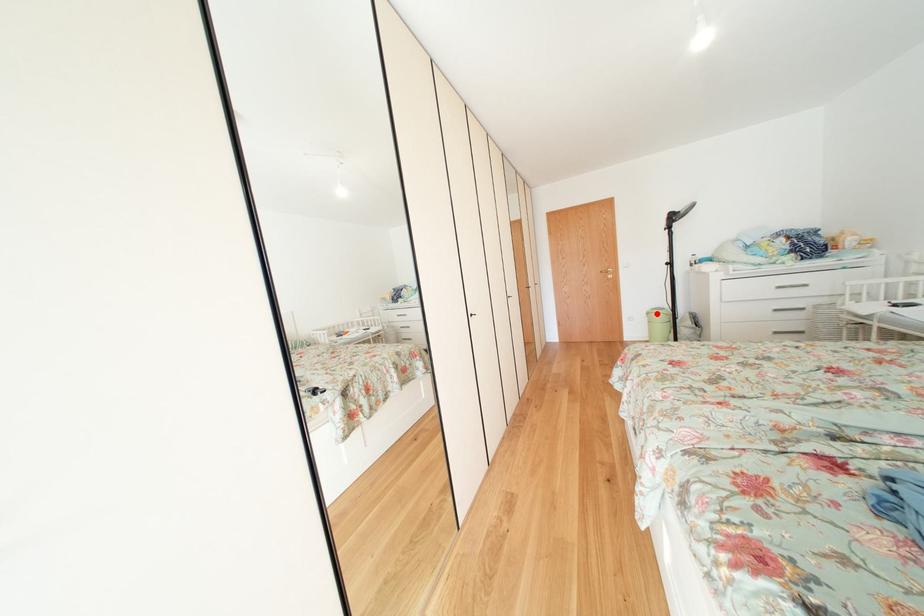
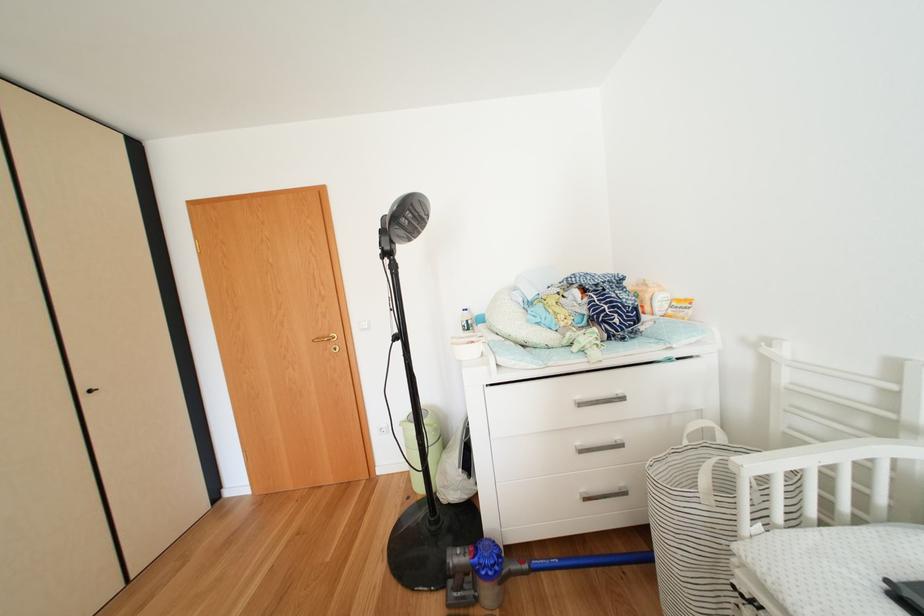
Question: I am providing you with two images of the same scene from different viewpoints. A red point is marked on the first image. Is the red point's position out of view in image 2?

Choices:
 (A) Yes
 (B) No

Answer: (A)